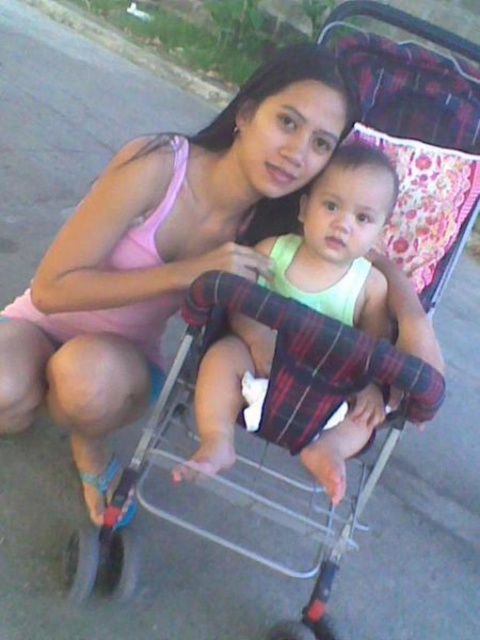
Question: Is pink fabric at center wider than light green fabric baby at center?

Choices:
 (A) no
 (B) yes

Answer: (B)

Question: Does pink fabric at center lie behind light green fabric baby at center?

Choices:
 (A) yes
 (B) no

Answer: (A)

Question: Does pink fabric at center have a greater width compared to light green fabric baby at center?

Choices:
 (A) yes
 (B) no

Answer: (A)

Question: Which point is closer to the camera?

Choices:
 (A) pink fabric at center
 (B) light green fabric baby at center

Answer: (B)